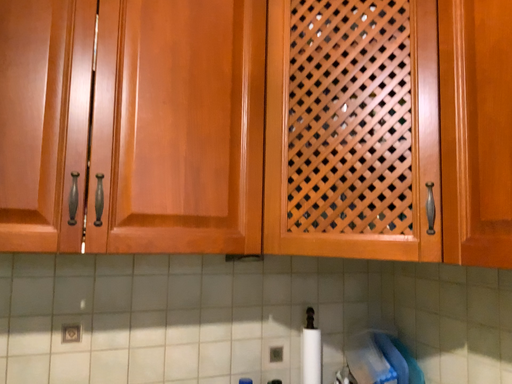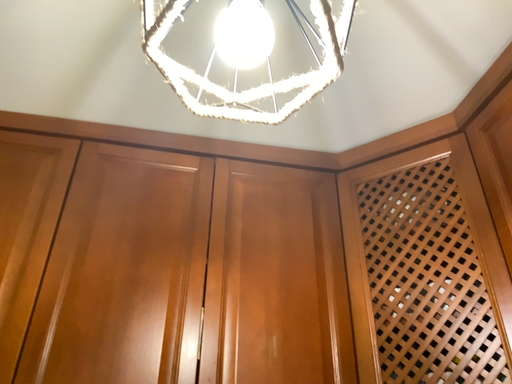
Question: Which way did the camera rotate in the video?

Choices:
 (A) rotated right
 (B) rotated left

Answer: (B)